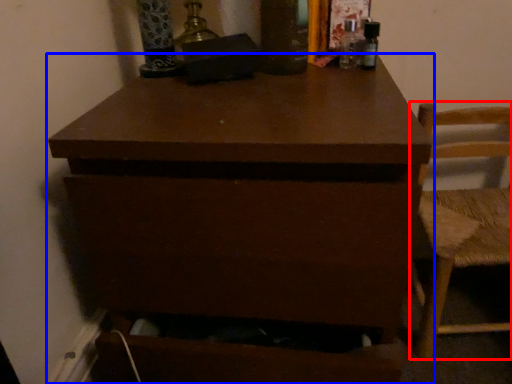
Question: Which of the following is the closest to the observer, chair (highlighted by a red box) or chest of drawers (highlighted by a blue box)?

Choices:
 (A) chair
 (B) chest of drawers

Answer: (B)